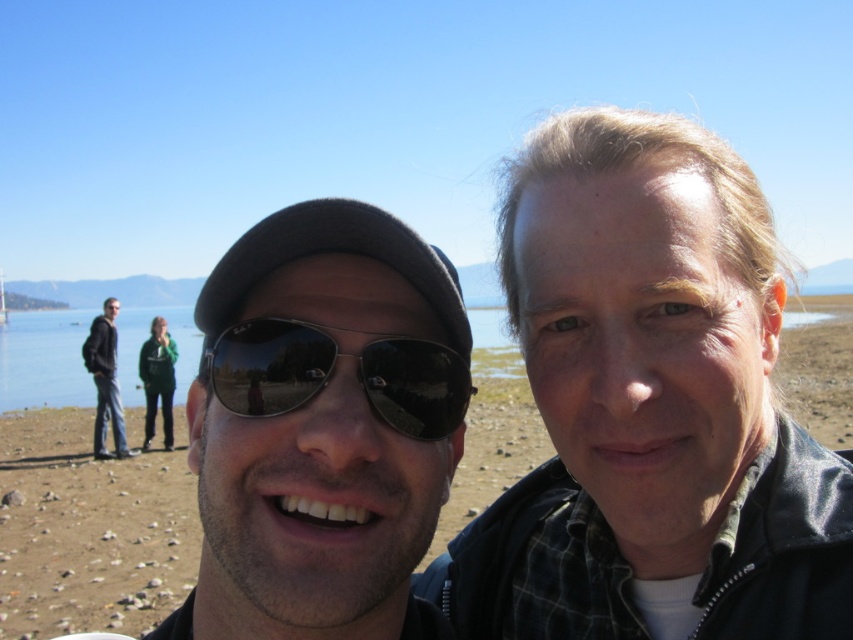
Question: Can you confirm if clear blue water at center is positioned below dark gray jacket at left?

Choices:
 (A) yes
 (B) no

Answer: (B)

Question: Which of the following is the closest to the observer?

Choices:
 (A) (103, 381)
 (B) (335, 326)
 (C) (238, 408)
 (D) (115, 358)

Answer: (C)

Question: Which of the following is the farthest from the observer?

Choices:
 (A) (64, 412)
 (B) (408, 353)

Answer: (A)

Question: Which point appears closest to the camera in this image?

Choices:
 (A) (177, 310)
 (B) (325, 346)
 (C) (73, 326)

Answer: (B)

Question: Is matte black sunglasses at center above clear blue water at center?

Choices:
 (A) yes
 (B) no

Answer: (B)

Question: Is matte black sunglasses at center to the right of brown sand at center from the viewer's perspective?

Choices:
 (A) yes
 (B) no

Answer: (A)